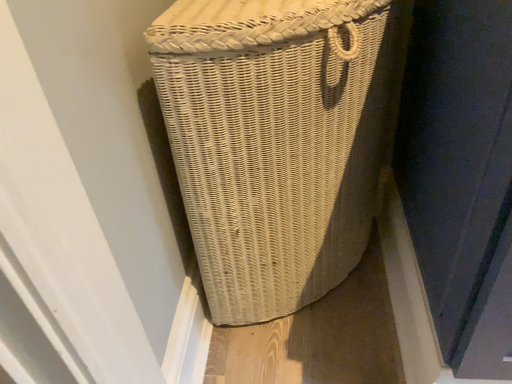
Where is `white wicker laundry basket at center`? white wicker laundry basket at center is located at coordinates (278, 139).

Describe the element at coordinates (278, 139) in the screenshot. I see `white wicker laundry basket at center` at that location.

In the scene shown: In order to face white wicker laundry basket at center, should I rotate leftwards or rightwards?

You should rotate right by 5.964 degrees.

Identify the location of white wicker laundry basket at center. (278, 139).